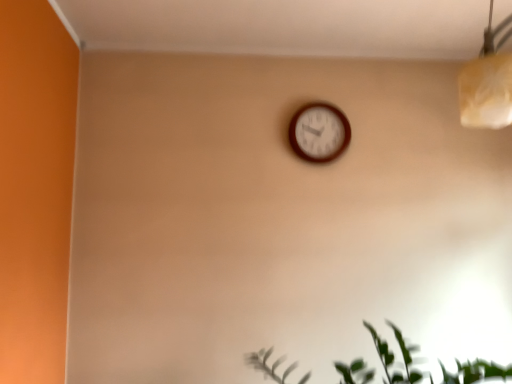
Describe the element at coordinates (319, 132) in the screenshot. I see `wooden wall clock at center` at that location.

What is the approximate height of wooden wall clock at center?

12.44 inches.

The image size is (512, 384). Find the location of `wooden wall clock at center`. wooden wall clock at center is located at coordinates (319, 132).

Describe the element at coordinates (394, 357) in the screenshot. I see `green leafy plant at lower right` at that location.

Find the location of a particular element. green leafy plant at lower right is located at coordinates (394, 357).

This screenshot has width=512, height=384. Identify the location of wooden wall clock at center. (319, 132).

Considering the relative positions of wooden wall clock at center and green leafy plant at lower right in the image provided, is wooden wall clock at center to the left of green leafy plant at lower right from the viewer's perspective?

Yes.

Based on the photo, is the depth of wooden wall clock at center greater than that of green leafy plant at lower right?

That is True.

Which point is more distant from viewer, [319,155] or [285,379]?

The point [319,155] is farther from the camera.

From the image's perspective, which object appears higher, wooden wall clock at center or green leafy plant at lower right?

wooden wall clock at center, from the image's perspective.

From a real-world perspective, between wooden wall clock at center and green leafy plant at lower right, who is vertically lower?

From a 3D spatial view, green leafy plant at lower right is below.

Between wooden wall clock at center and green leafy plant at lower right, which one has larger width?

green leafy plant at lower right.

Which of these two, wooden wall clock at center or green leafy plant at lower right, stands shorter?

green leafy plant at lower right is shorter.

Does wooden wall clock at center have a smaller size compared to green leafy plant at lower right?

Indeed, wooden wall clock at center has a smaller size compared to green leafy plant at lower right.

Based on the photo, is wooden wall clock at center inside the boundaries of green leafy plant at lower right, or outside?

wooden wall clock at center cannot be found inside green leafy plant at lower right.

Is wooden wall clock at center with green leafy plant at lower right?

No, wooden wall clock at center is not with green leafy plant at lower right.

Does wooden wall clock at center turn towards green leafy plant at lower right?

No, wooden wall clock at center is not oriented towards green leafy plant at lower right.

Where is `wall clock that appears above the green leafy plant at lower right (from the image's perspective)`? The height and width of the screenshot is (384, 512). wall clock that appears above the green leafy plant at lower right (from the image's perspective) is located at coordinates (319, 132).

Which is more to the right, green leafy plant at lower right or wooden wall clock at center?

green leafy plant at lower right.

Which object is more forward, green leafy plant at lower right or wooden wall clock at center?

green leafy plant at lower right is more forward.

Considering the points (416, 374) and (309, 113), which point is behind, point (416, 374) or point (309, 113)?

Point (309, 113)

From the image's perspective, does green leafy plant at lower right appear lower than wooden wall clock at center?

Yes.

From a real-world perspective, is green leafy plant at lower right under wooden wall clock at center?

Yes.

Can you confirm if green leafy plant at lower right is thinner than wooden wall clock at center?

No.

Can you confirm if green leafy plant at lower right is shorter than wooden wall clock at center?

Yes, green leafy plant at lower right is shorter than wooden wall clock at center.

Which of these two, green leafy plant at lower right or wooden wall clock at center, is bigger?

With larger size is green leafy plant at lower right.

Is green leafy plant at lower right not inside wooden wall clock at center?

Yes, green leafy plant at lower right is not within wooden wall clock at center.

Are green leafy plant at lower right and wooden wall clock at center located far from each other?

Actually, green leafy plant at lower right and wooden wall clock at center are a little close together.

Is green leafy plant at lower right facing away from wooden wall clock at center?

No.

Find the location of a particular element. The width and height of the screenshot is (512, 384). houseplant that is in front of the wooden wall clock at center is located at coordinates (394, 357).

You are a GUI agent. You are given a task and a screenshot of the screen. Output one action in this format:
    pyautogui.click(x=<x>, y=<y>)
    Task: Click on the houseplant that is on the right side of wooden wall clock at center
    
    Given the screenshot: What is the action you would take?
    pyautogui.click(x=394, y=357)

At what (x,y) coordinates should I click in order to perform the action: click on wall clock above the green leafy plant at lower right (from a real-world perspective). Please return your answer as a coordinate pair (x, y). Image resolution: width=512 pixels, height=384 pixels. Looking at the image, I should click on (319, 132).